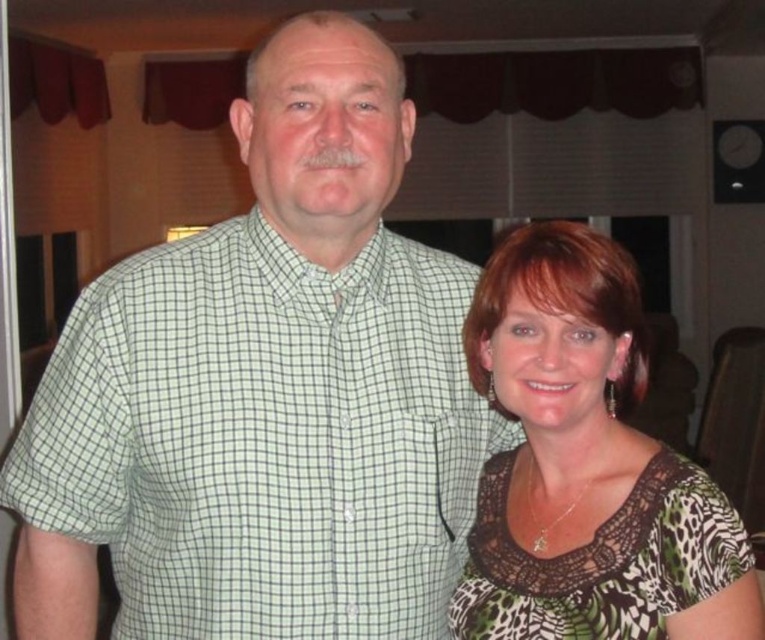
Question: Does green checkered shirt at center have a smaller size compared to printed fabric blouse at right?

Choices:
 (A) yes
 (B) no

Answer: (A)

Question: Is green checkered shirt at center in front of printed fabric blouse at right?

Choices:
 (A) yes
 (B) no

Answer: (B)

Question: Which point is closer to the camera taking this photo?

Choices:
 (A) (114, 488)
 (B) (610, 554)

Answer: (B)

Question: Can you confirm if green checkered shirt at center is positioned to the left of printed fabric blouse at right?

Choices:
 (A) yes
 (B) no

Answer: (A)